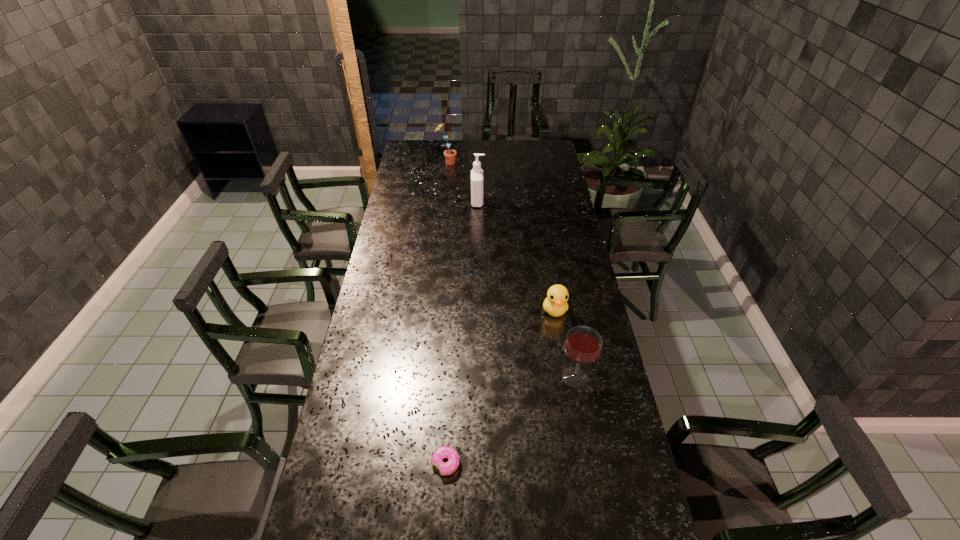
I want to click on free space located 0.220m on the left of the fourth farthest object, so click(490, 377).

Where is `free space located on the face of the duck`? free space located on the face of the duck is located at coordinates (562, 354).

Image resolution: width=960 pixels, height=540 pixels. Find the location of `vacant space located on the left of the doughnut`. vacant space located on the left of the doughnut is located at coordinates (385, 463).

Locate an element on the screen. The image size is (960, 540). object located at the far edge is located at coordinates (450, 155).

This screenshot has width=960, height=540. Identify the location of wineglass positioned at the right edge. (583, 344).

Identify the location of duck that is at the right edge. Image resolution: width=960 pixels, height=540 pixels. (555, 304).

Where is `vacant space at the far edge`? Image resolution: width=960 pixels, height=540 pixels. vacant space at the far edge is located at coordinates tap(458, 140).

This screenshot has width=960, height=540. In order to click on vacant space at the left edge of the desktop in this screenshot , I will do `click(323, 468)`.

Image resolution: width=960 pixels, height=540 pixels. I want to click on vacant area at the right edge, so click(x=574, y=232).

I want to click on free space at the far left corner of the desktop, so click(x=418, y=152).